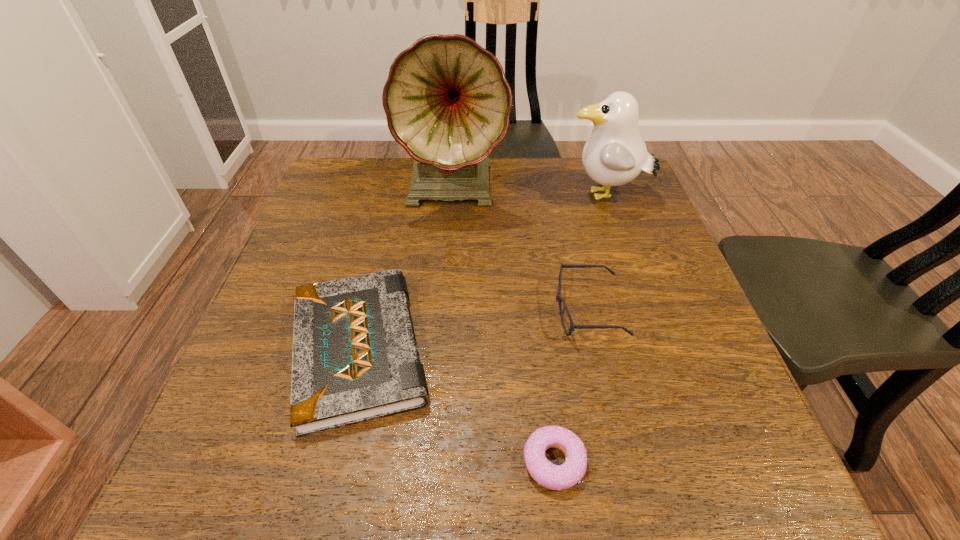
You are a GUI agent. You are given a task and a screenshot of the screen. Output one action in this format:
    pyautogui.click(x=<x>, y=<y>)
    Task: Click on the free space that satisfies the following two spatial constraints: 1. from the horn of the record player; 2. on the left side of the shortest object
    The width and height of the screenshot is (960, 540).
    Given the screenshot: What is the action you would take?
    pyautogui.click(x=436, y=462)

Where is `free location that satisfies the following two spatial constraints: 1. on the front side of the doughnut; 2. on the right side of the second shortest object`? free location that satisfies the following two spatial constraints: 1. on the front side of the doughnut; 2. on the right side of the second shortest object is located at coordinates (332, 462).